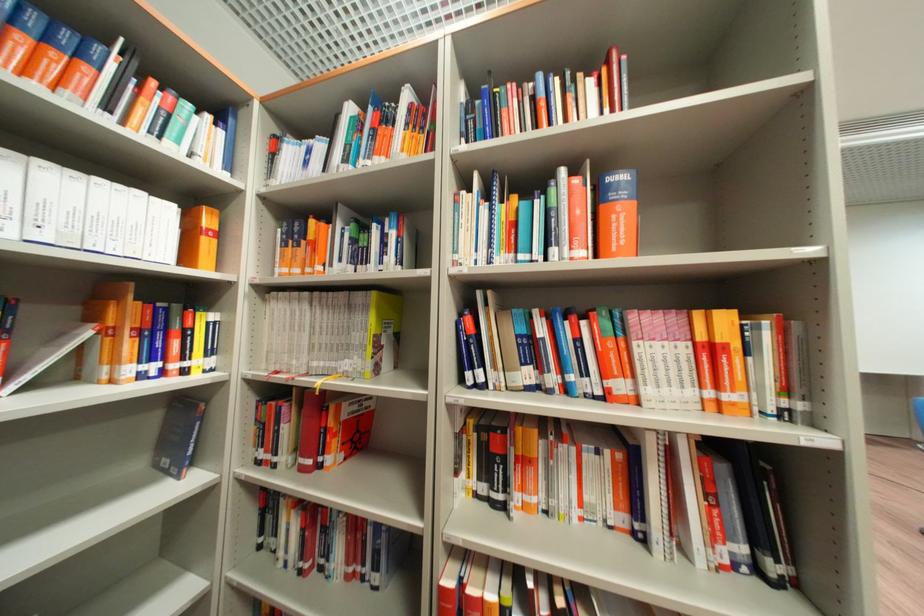
The location [199,238] corresponds to which object?

It corresponds to the orange book box in the image.